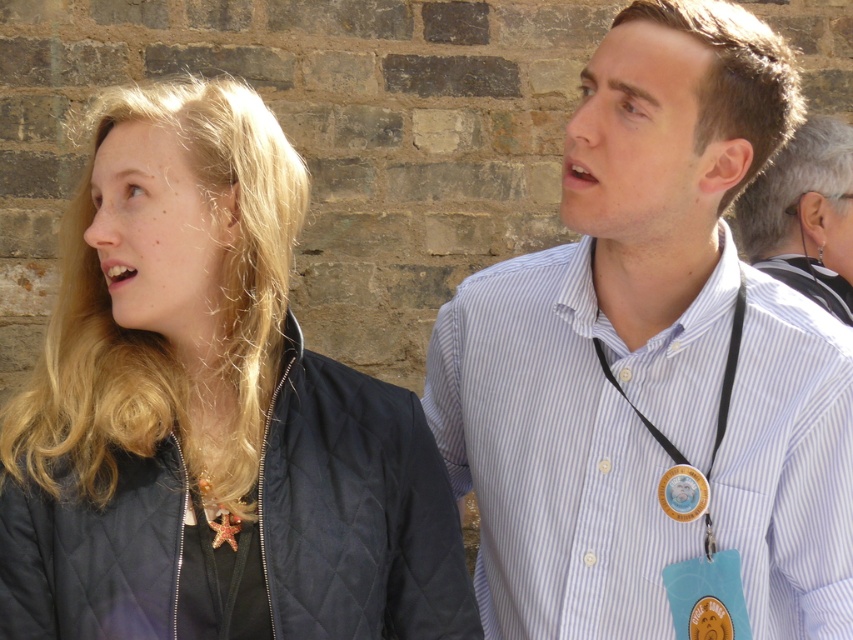
Question: From the image, what is the correct spatial relationship of white striped shirt at upper right in relation to gold metallic badge at center?

Choices:
 (A) left
 (B) right

Answer: (B)

Question: Can you confirm if quilted navy jacket at left is thinner than white striped shirt at upper right?

Choices:
 (A) no
 (B) yes

Answer: (A)

Question: Which of the following is the farthest from the observer?

Choices:
 (A) (805, 131)
 (B) (674, 465)

Answer: (A)

Question: Can you confirm if white striped shirt at upper right is bigger than gold metallic badge at center?

Choices:
 (A) yes
 (B) no

Answer: (A)

Question: Based on their relative distances, which object is farther from the gold metallic badge at center?

Choices:
 (A) quilted navy jacket at left
 (B) white striped shirt at center

Answer: (A)

Question: Among these objects, which one is farthest from the camera?

Choices:
 (A) gold metallic badge at center
 (B) white striped shirt at center

Answer: (A)